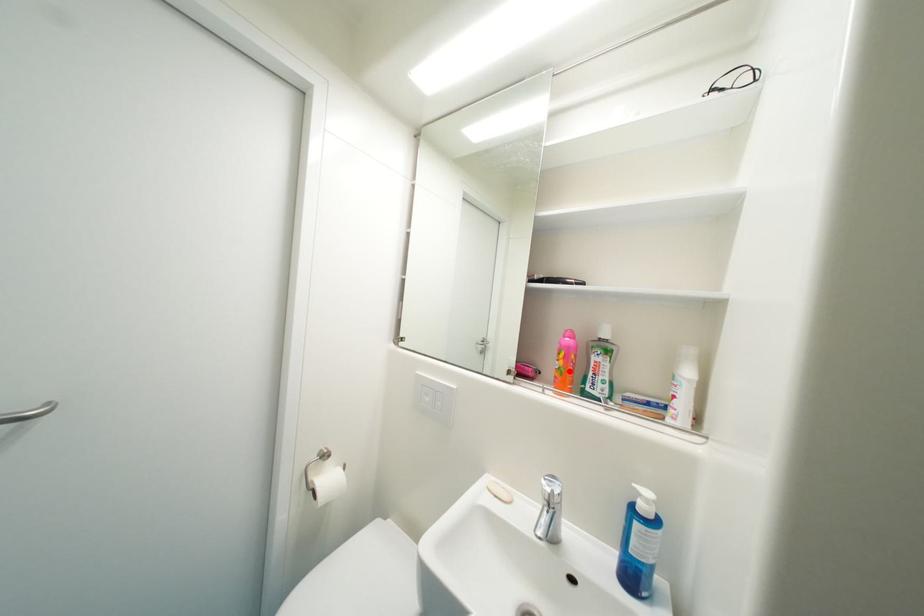
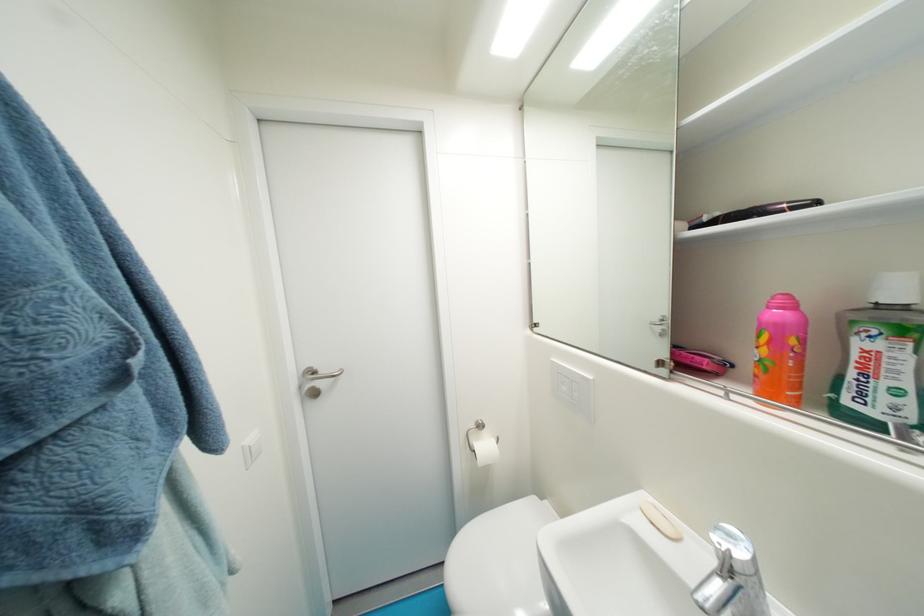
Locate, in the second image, the point that corresponds to the highlighted location in the first image.

(774, 363)